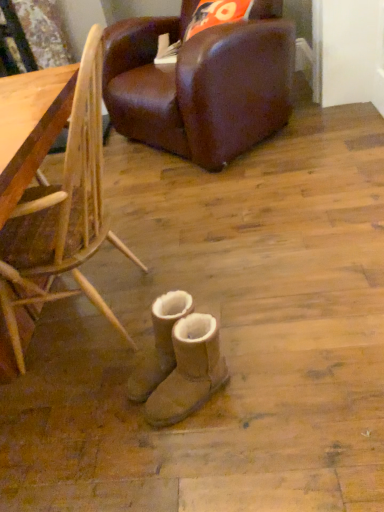
Question: Is tan suede boots at center, positioned as the first footwear in front-to-back order, not close to tan suede boots at center, which appears as the first footwear when viewed from the back?

Choices:
 (A) no
 (B) yes

Answer: (A)

Question: Is tan suede boots at center, the second footwear in the back-to-front sequence, behind tan suede boots at center, which appears as the first footwear when viewed from the back?

Choices:
 (A) no
 (B) yes

Answer: (A)

Question: Is tan suede boots at center, positioned as the first footwear in front-to-back order, to the right of tan suede boots at center, which appears as the first footwear when viewed from the back, from the viewer's perspective?

Choices:
 (A) yes
 (B) no

Answer: (A)

Question: From a real-world perspective, is tan suede boots at center, positioned as the first footwear in front-to-back order, positioned over tan suede boots at center, which appears as the first footwear when viewed from the back, based on gravity?

Choices:
 (A) no
 (B) yes

Answer: (A)

Question: Are tan suede boots at center, the second footwear in the back-to-front sequence, and tan suede boots at center, the 2th footwear positioned from the front, beside each other?

Choices:
 (A) no
 (B) yes

Answer: (B)

Question: Is brown leather chair at upper center, the 2th chair positioned from the bottom, taller or shorter than tan suede boots at center, which appears as the first footwear when viewed from the back?

Choices:
 (A) tall
 (B) short

Answer: (A)

Question: Considering the positions of point (281, 2) and point (155, 367), is point (281, 2) closer or farther from the camera than point (155, 367)?

Choices:
 (A) closer
 (B) farther

Answer: (B)

Question: From the image's perspective, relative to tan suede boots at center, the 2th footwear positioned from the front, is brown leather chair at upper center, the first chair when ordered from back to front, above or below?

Choices:
 (A) below
 (B) above

Answer: (B)

Question: Considering the relative positions of brown leather chair at upper center, the 2th chair when ordered from front to back, and tan suede boots at center, the 2th footwear positioned from the front, in the image provided, is brown leather chair at upper center, the 2th chair when ordered from front to back, to the left or to the right of tan suede boots at center, the 2th footwear positioned from the front,?

Choices:
 (A) left
 (B) right

Answer: (B)

Question: From a real-world perspective, relative to tan suede boots at center, which appears as the first footwear when viewed from the back, is bamboo chair at lower right, positioned as the 2th chair in top-to-bottom order, vertically above or below?

Choices:
 (A) above
 (B) below

Answer: (A)

Question: Is bamboo chair at lower right, which is the first chair in bottom-to-top order, in front of or behind tan suede boots at center, which appears as the first footwear when viewed from the back, in the image?

Choices:
 (A) behind
 (B) front

Answer: (B)

Question: Is point (56, 264) closer or farther from the camera than point (165, 338)?

Choices:
 (A) closer
 (B) farther

Answer: (A)

Question: Considering the positions of bamboo chair at lower right, marked as the second chair in a back-to-front arrangement, and tan suede boots at center, which appears as the first footwear when viewed from the back, in the image, is bamboo chair at lower right, marked as the second chair in a back-to-front arrangement, taller or shorter than tan suede boots at center, which appears as the first footwear when viewed from the back,?

Choices:
 (A) tall
 (B) short

Answer: (A)

Question: Considering the positions of point (157, 355) and point (87, 56), is point (157, 355) closer or farther from the camera than point (87, 56)?

Choices:
 (A) closer
 (B) farther

Answer: (B)

Question: Is tan suede boots at center, the 2th footwear positioned from the front, to the left or to the right of bamboo chair at lower right, which is the first chair in bottom-to-top order, in the image?

Choices:
 (A) left
 (B) right

Answer: (B)